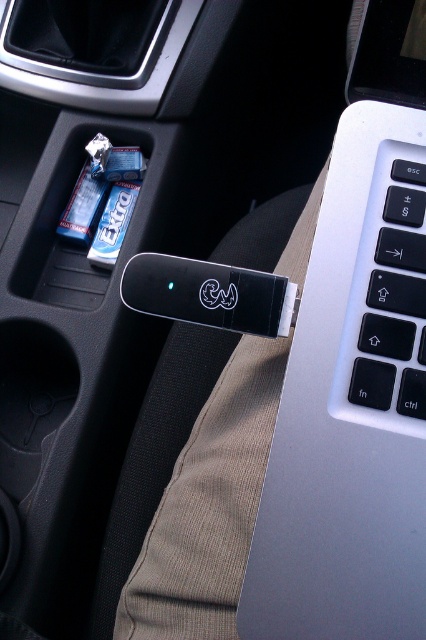
Can you confirm if silver metallic laptop at center-right is positioned below white plastic keyboard at upper right?

Correct, silver metallic laptop at center-right is located below white plastic keyboard at upper right.

The image size is (426, 640). In order to click on silver metallic laptop at center-right in this screenshot , I will do `click(356, 372)`.